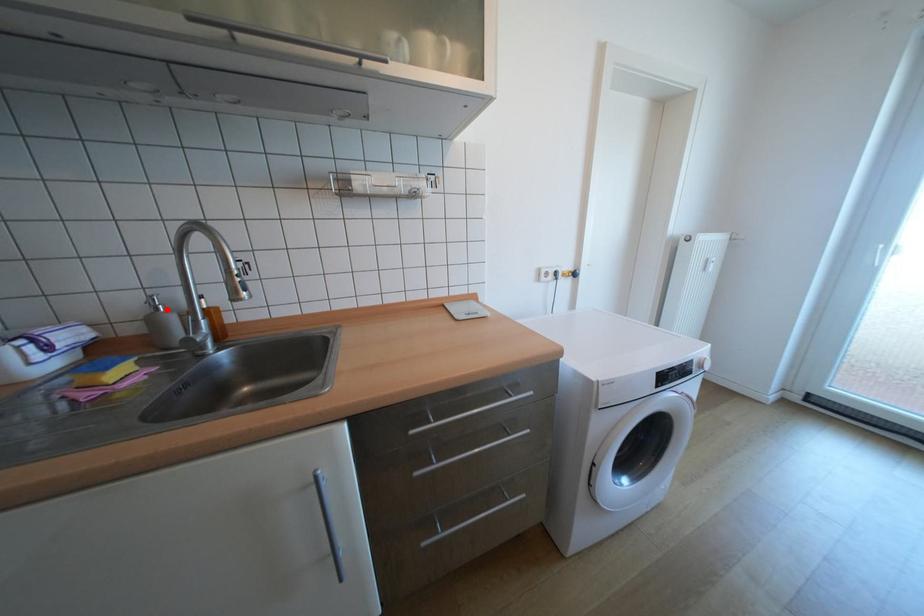
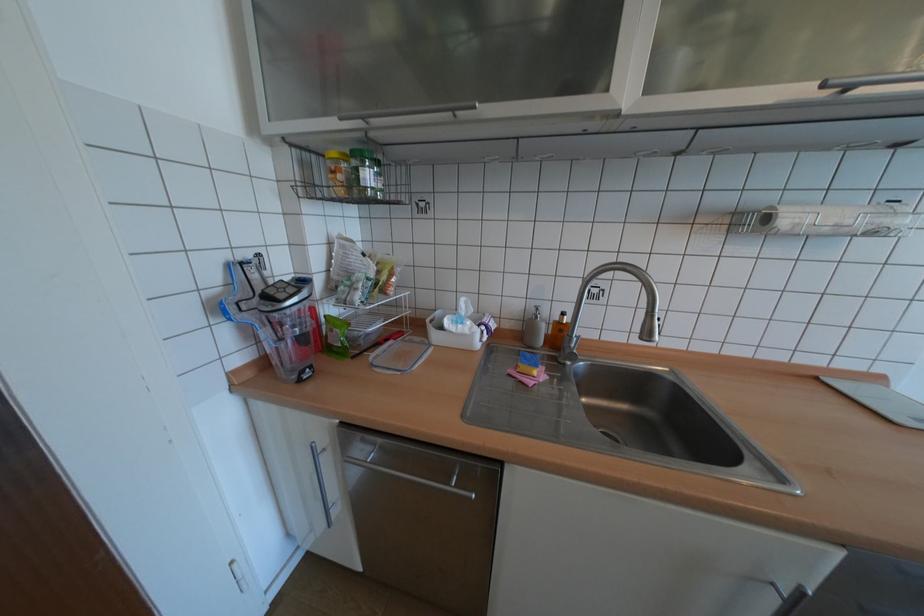
Find the pixel in the second image that matches the highlighted location in the first image.

(545, 317)